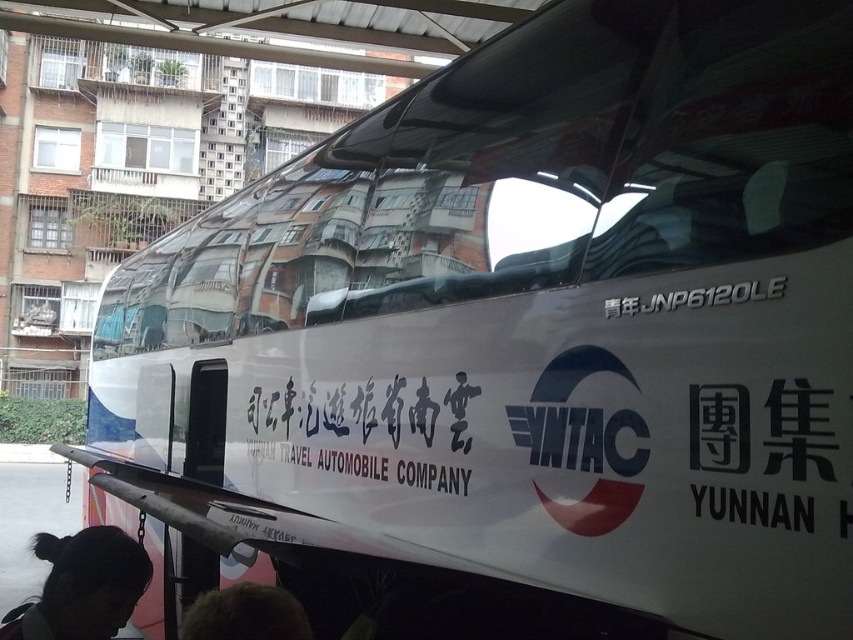
Question: Is dark brown hair at lower center to the left of white metallic text at center from the viewer's perspective?

Choices:
 (A) no
 (B) yes

Answer: (B)

Question: Can you confirm if black hair at lower left is positioned below white metallic text at center?

Choices:
 (A) yes
 (B) no

Answer: (A)

Question: Which point is closer to the camera?

Choices:
 (A) (73, 592)
 (B) (703, 300)
 (C) (305, 637)

Answer: (C)

Question: Estimate the real-world distances between objects in this image. Which object is farther from the black hair at lower left?

Choices:
 (A) white metallic text at center
 (B) dark brown hair at lower center

Answer: (A)

Question: Which object appears closest to the camera in this image?

Choices:
 (A) dark brown hair at lower center
 (B) black hair at lower left

Answer: (A)

Question: Does black hair at lower left have a smaller size compared to white metallic text at center?

Choices:
 (A) no
 (B) yes

Answer: (A)